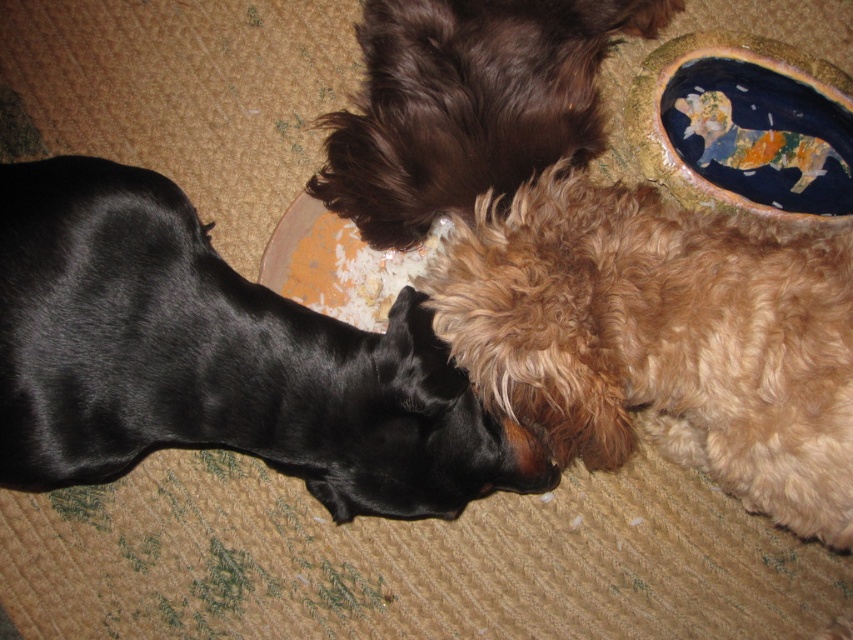
You are a dog trainer assessing the space needed for these two dogs. Given that the black shiny fur dog at lower left is wider than the brown fluffy dog at upper center, which dog requires a larger area to move comfortably?

The black shiny fur dog at lower left requires a larger area to move comfortably because its width surpasses that of the brown fluffy dog at upper center.